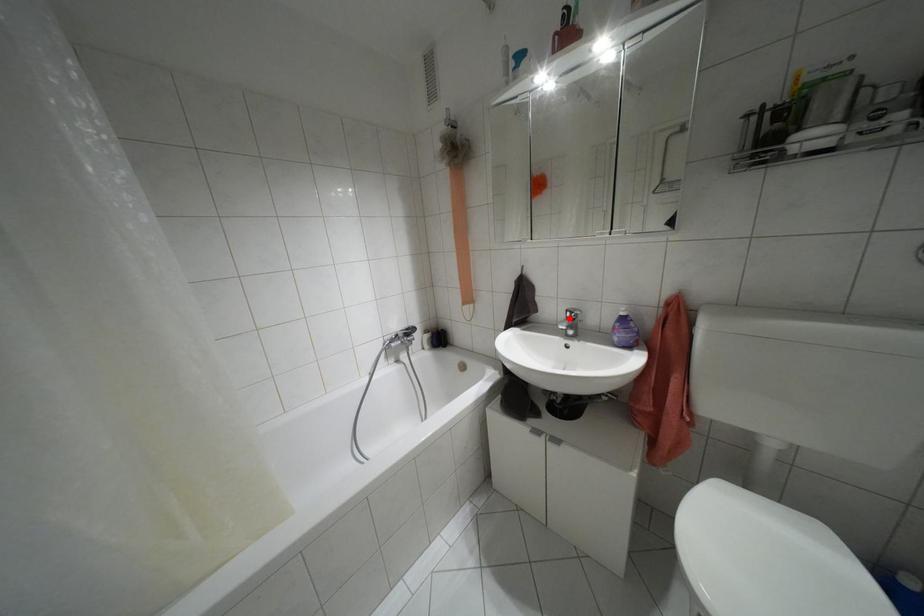
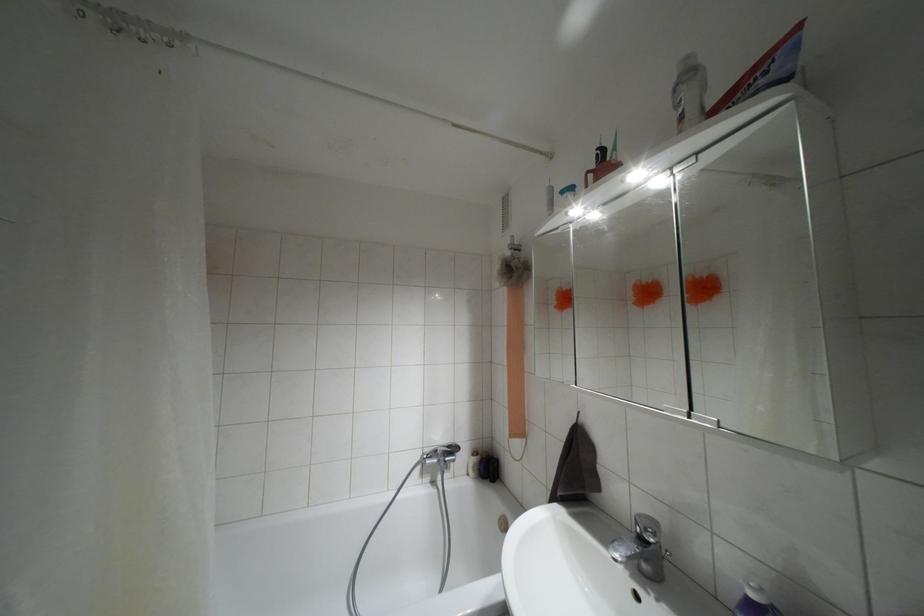
Where in the second image is the point corresponding to the highlighted location from the first image?

(641, 538)